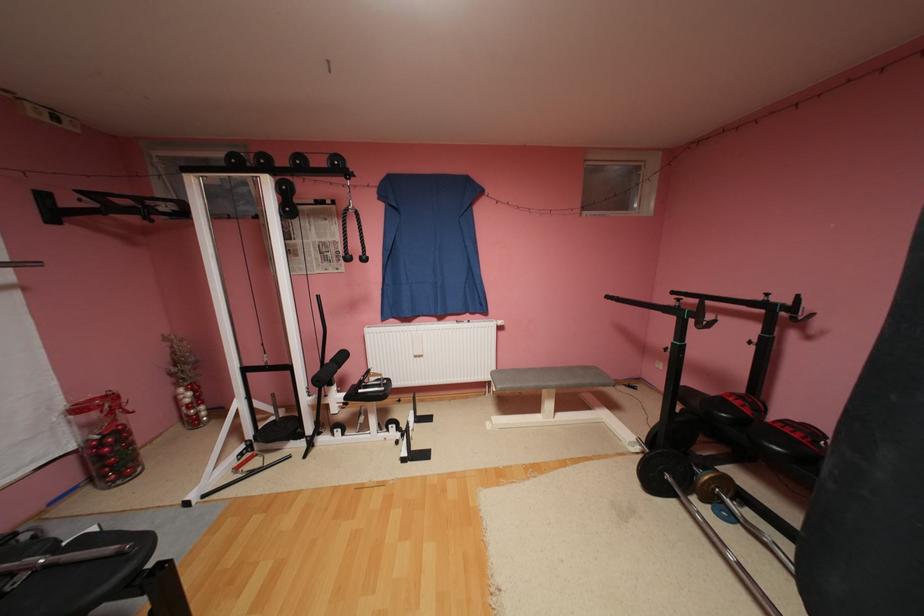
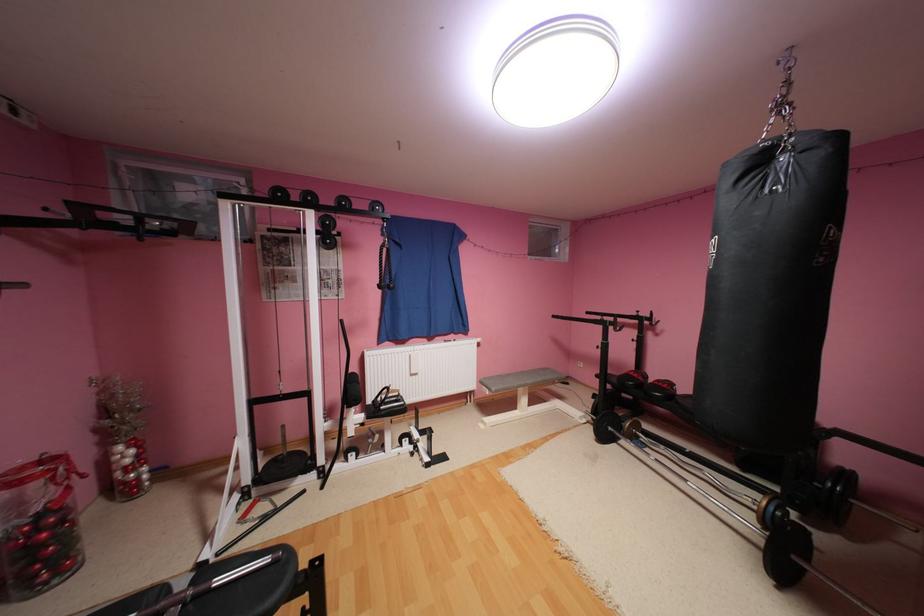
The point at (259, 435) is marked in the first image. Where is the corresponding point in the second image?

(256, 479)